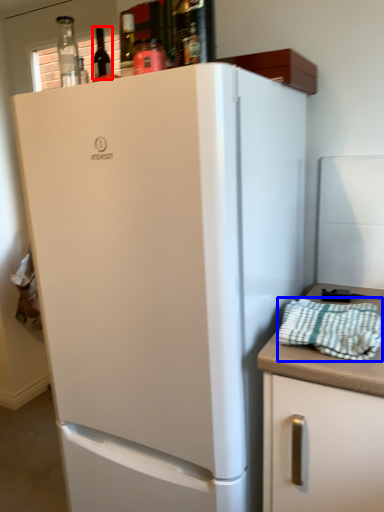
Question: Which object is closer to the camera taking this photo, wine bottle (highlighted by a red box) or blanket (highlighted by a blue box)?

Choices:
 (A) wine bottle
 (B) blanket

Answer: (B)